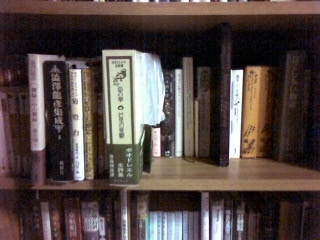
You are a GUI agent. You are given a task and a screenshot of the screen. Output one action in this format:
    pyautogui.click(x=<x>, y=<y>)
    Task: Click on the left side of bookcase on the left
    Image resolution: width=320 pixels, height=240 pixels.
    Given the screenshot: What is the action you would take?
    pyautogui.click(x=15, y=80)